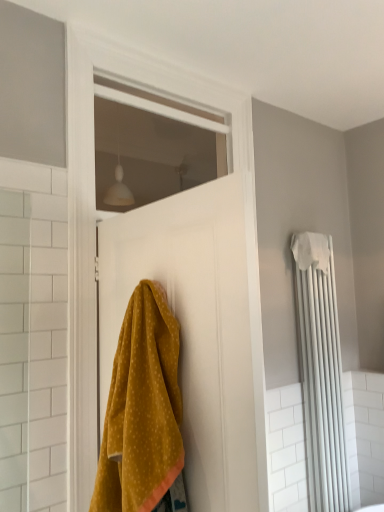
What do you see at coordinates (311, 251) in the screenshot? The image size is (384, 512). I see `white fabric bath towel at right` at bounding box center [311, 251].

The width and height of the screenshot is (384, 512). I want to click on white matte radiator at right, so click(x=321, y=372).

Image resolution: width=384 pixels, height=512 pixels. In order to click on white fabric bath towel at right in this screenshot , I will do `click(311, 251)`.

Based on the photo, between mustard yellow fabric at center and white matte radiator at right, which one has larger width?

Wider between the two is mustard yellow fabric at center.

Could you tell me if mustard yellow fabric at center is turned towards white matte radiator at right?

No, mustard yellow fabric at center is not facing towards white matte radiator at right.

From a real-world perspective, is mustard yellow fabric at center positioned under white matte radiator at right based on gravity?

No, from a real-world perspective, mustard yellow fabric at center is not below white matte radiator at right.

Between mustard yellow fabric at center and white matte radiator at right, which one has more height?

white matte radiator at right is taller.

How different are the orientations of white fabric bath towel at right and white glass window at upper center in degrees?

white fabric bath towel at right and white glass window at upper center are facing 0.0525 degrees away from each other.

Is white fabric bath towel at right further to the viewer compared to white glass window at upper center?

Yes, white fabric bath towel at right is further from the camera.

Is white fabric bath towel at right far away from white glass window at upper center?

white fabric bath towel at right is far away from white glass window at upper center.

In the scene shown: Is white fabric bath towel at right wider or thinner than white glass window at upper center?

Considering their sizes, white fabric bath towel at right looks broader than white glass window at upper center.

From a real-world perspective, is white glass window at upper center positioned above or below mustard yellow fabric at center?

white glass window at upper center is situated higher than mustard yellow fabric at center in the real world.

Would you say white glass window at upper center contains mustard yellow fabric at center?

Definitely not — mustard yellow fabric at center is not inside white glass window at upper center.

In the scene shown: From the image's perspective, is white glass window at upper center under mustard yellow fabric at center?

Actually, white glass window at upper center appears above mustard yellow fabric at center in the image.

Which is behind, point (178, 160) or point (120, 343)?

The point (178, 160) is farther from the camera.

How many degrees apart are the facing directions of white matte radiator at right and white matte door at center?

0.181 degrees.

Considering the sizes of objects white matte radiator at right and white matte door at center in the image provided, who is shorter, white matte radiator at right or white matte door at center?

white matte radiator at right.

From the image's perspective, does white matte radiator at right appear lower than white matte door at center?

Yes, from the image's perspective, white matte radiator at right is below white matte door at center.

Is white matte radiator at right far from white matte door at center?

No.

Is white fabric bath towel at right taller than white matte door at center?

No.

How different are the orientations of white fabric bath towel at right and white matte door at center in degrees?

The angle between the facing direction of white fabric bath towel at right and the facing direction of white matte door at center is 0.181 degrees.

From a real-world perspective, is white fabric bath towel at right physically below white matte door at center?

No.

Does white fabric bath towel at right have a larger size compared to white matte door at center?

No.

Is white matte radiator at right positioned with its back to white glass window at upper center?

No.

Considering the sizes of objects white matte radiator at right and white glass window at upper center in the image provided, who is thinner, white matte radiator at right or white glass window at upper center?

Thinner between the two is white glass window at upper center.

From a real-world perspective, is white matte radiator at right above or below white glass window at upper center?

In terms of real-world spatial position, white matte radiator at right is below white glass window at upper center.

I want to click on shower curtain that appears behind the white glass window at upper center, so click(x=321, y=372).

Which is less distant, (x=85, y=320) or (x=113, y=364)?

Clearly, point (x=85, y=320) is more distant from the camera than point (x=113, y=364).

Is white matte door at center inside the boundaries of mustard yellow fabric at center, or outside?

white matte door at center is outside mustard yellow fabric at center.

From a real-world perspective, is white matte door at center above or below mustard yellow fabric at center?

Clearly, from a real-world perspective, white matte door at center is above mustard yellow fabric at center.

Are white matte door at center and mustard yellow fabric at center making contact?

No, white matte door at center is not making contact with mustard yellow fabric at center.

At what (x,y) coordinates should I click in order to perform the action: click on towel above the white matte radiator at right (from a real-world perspective). Please return your answer as a coordinate pair (x, y). This screenshot has height=512, width=384. Looking at the image, I should click on (142, 410).

I want to click on bath towel behind the white glass window at upper center, so click(x=311, y=251).

When comparing their distances from white glass window at upper center, does white matte door at center or white fabric bath towel at right seem further?

Based on the image, white fabric bath towel at right appears to be further to white glass window at upper center.

From the image, which object appears to be farther from white fabric bath towel at right, white matte door at center or mustard yellow fabric at center?

mustard yellow fabric at center lies further to white fabric bath towel at right than the other object.

Estimate the real-world distances between objects in this image. Which object is further from mustard yellow fabric at center, white fabric bath towel at right or white matte door at center?

white fabric bath towel at right.

When comparing their distances from white matte door at center, does white glass window at upper center or white matte radiator at right seem further?

white glass window at upper center.

Considering their positions, is white matte door at center positioned further to mustard yellow fabric at center than white glass window at upper center?

The object further to mustard yellow fabric at center is white glass window at upper center.

When comparing their distances from white fabric bath towel at right, does white matte radiator at right or white glass window at upper center seem further?

white glass window at upper center lies further to white fabric bath towel at right than the other object.

From the image, which object appears to be nearer to white fabric bath towel at right, white matte radiator at right or mustard yellow fabric at center?

The object closer to white fabric bath towel at right is white matte radiator at right.

When comparing their distances from white matte door at center, does white glass window at upper center or white fabric bath towel at right seem further?

white glass window at upper center is further to white matte door at center.

At what (x,y) coordinates should I click in order to perform the action: click on door between white glass window at upper center and white fabric bath towel at right. Please return your answer as a coordinate pair (x, y). This screenshot has width=384, height=512. Looking at the image, I should click on (80, 279).

Locate an element on the screen. shower curtain between mustard yellow fabric at center and white fabric bath towel at right from front to back is located at coordinates (321, 372).

Identify the location of towel between white glass window at upper center and white matte radiator at right vertically. This screenshot has width=384, height=512. (142, 410).

Identify the location of bath towel between white matte door at center and white matte radiator at right in the horizontal direction. (311, 251).